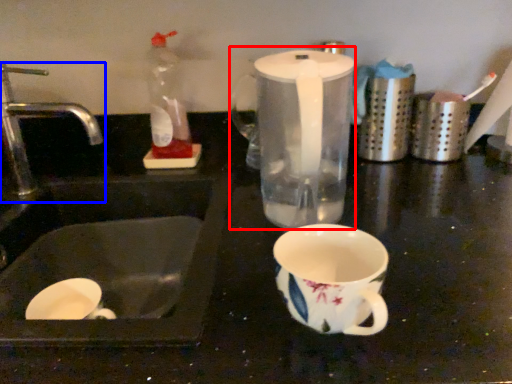
Question: Which of the following is the closest to the observer, blender (highlighted by a red box) or tap (highlighted by a blue box)?

Choices:
 (A) blender
 (B) tap

Answer: (A)